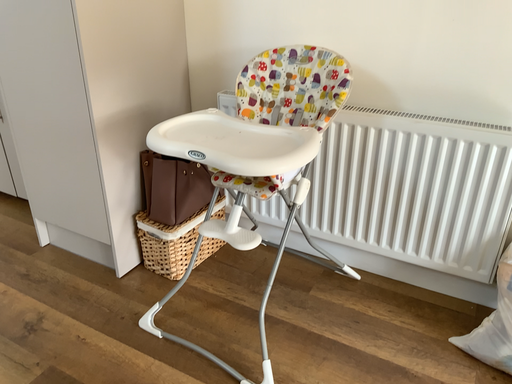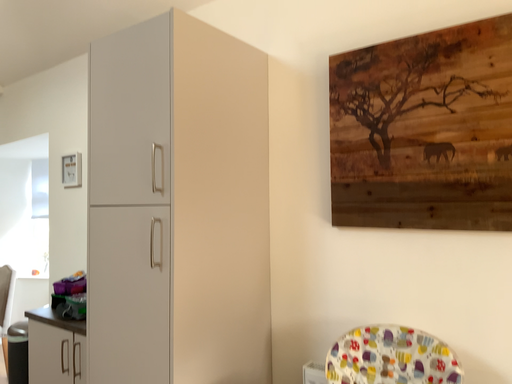
Question: How did the camera likely rotate when shooting the video?

Choices:
 (A) rotated downward
 (B) rotated upward

Answer: (B)